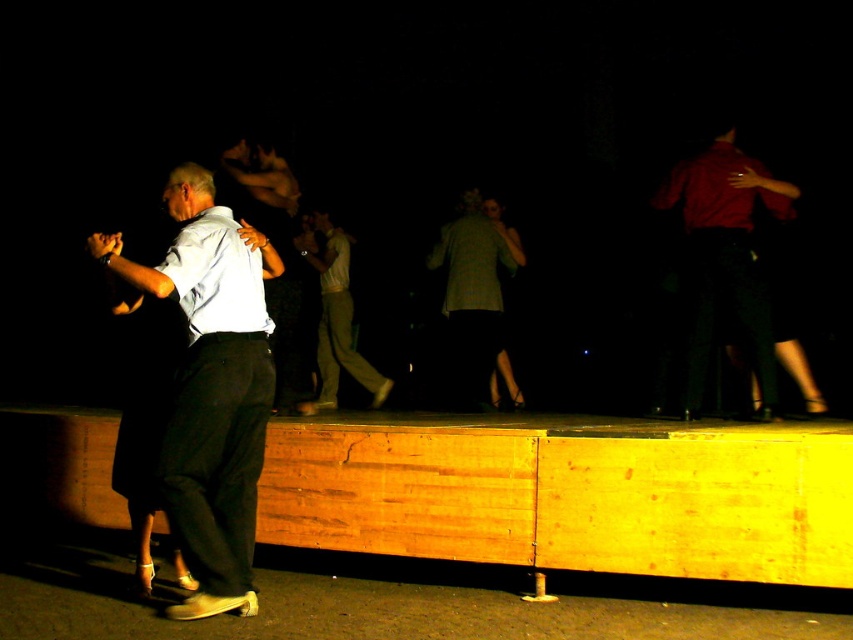
Does matte red shirt at upper right have a lesser height compared to light green cotton pants at center?

No.

Does matte red shirt at upper right appear on the right side of light green cotton pants at center?

Correct, you'll find matte red shirt at upper right to the right of light green cotton pants at center.

This screenshot has width=853, height=640. I want to click on matte red shirt at upper right, so click(724, 256).

Does green plaid shirt at center lie in front of light green cotton pants at center?

No, green plaid shirt at center is further to the viewer.

Consider the image. Does green plaid shirt at center appear on the left side of light green cotton pants at center?

No, green plaid shirt at center is not to the left of light green cotton pants at center.

Is point (459, 237) positioned behind point (323, 403)?

No.

Where is `green plaid shirt at center`? The height and width of the screenshot is (640, 853). green plaid shirt at center is located at coordinates (476, 294).

Can you confirm if light blue shirt at center is positioned to the right of matte red shirt at upper right?

Incorrect, light blue shirt at center is not on the right side of matte red shirt at upper right.

Who is lower down, light blue shirt at center or matte red shirt at upper right?

light blue shirt at center is below.

Identify the location of light blue shirt at center. (209, 385).